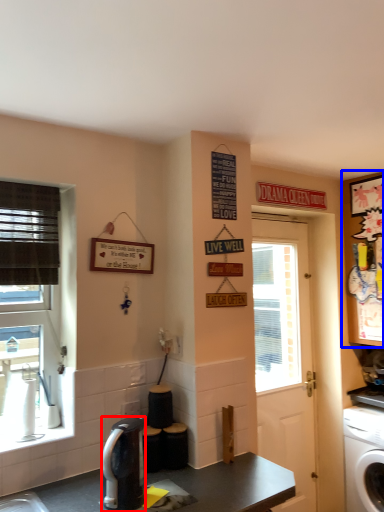
Question: Which object is closer to the camera taking this photo, coffee maker (highlighted by a red box) or cabinetry (highlighted by a blue box)?

Choices:
 (A) coffee maker
 (B) cabinetry

Answer: (A)